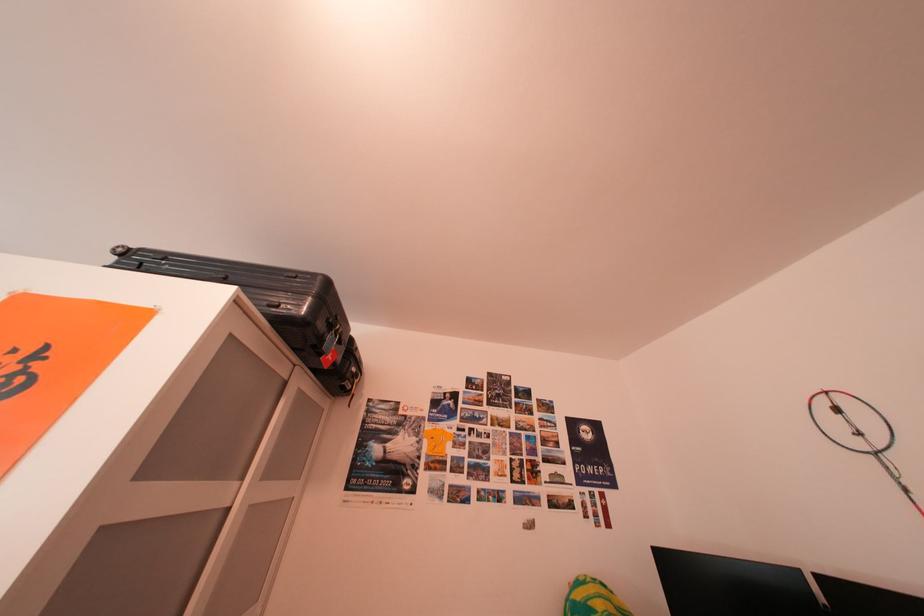
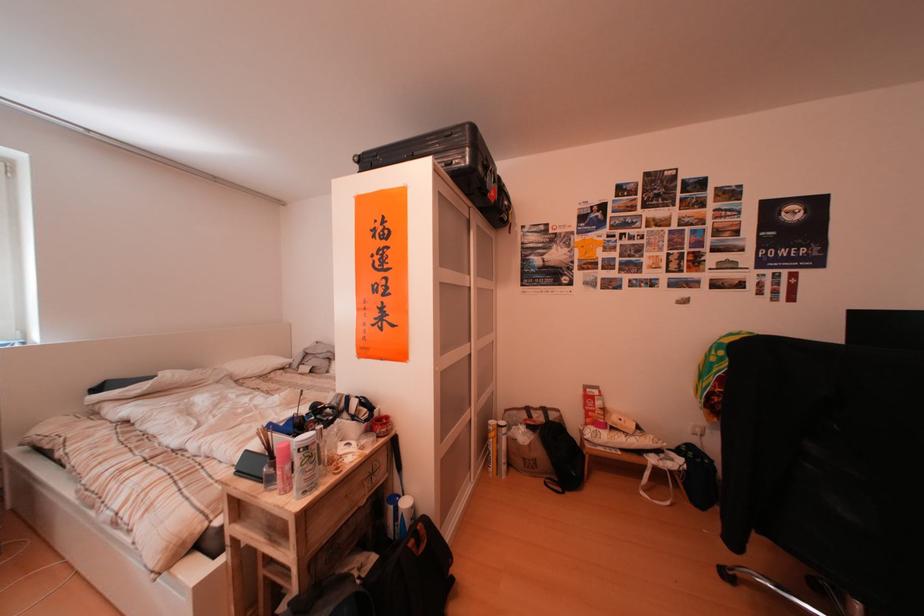
The first image is from the beginning of the video and the second image is from the end. How did the camera likely rotate when shooting the video?

The camera's rotation is toward left-down.